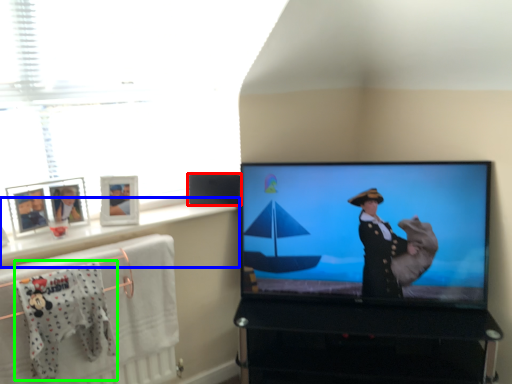
Question: Estimate the real-world distances between objects in this image. Which object is farther from speaker (highlighted by a red box), window sill (highlighted by a blue box) or baby clothe (highlighted by a green box)?

Choices:
 (A) window sill
 (B) baby clothe

Answer: (B)